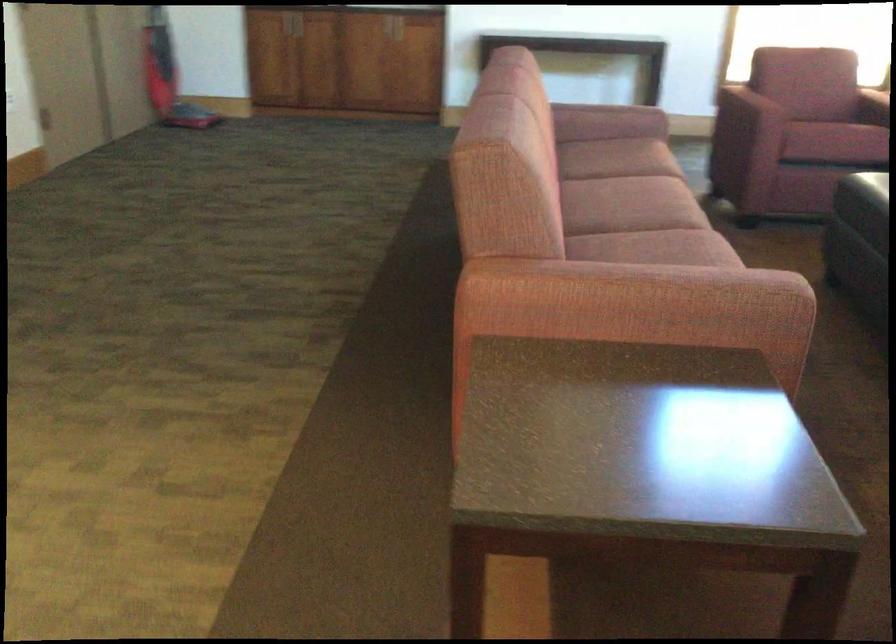
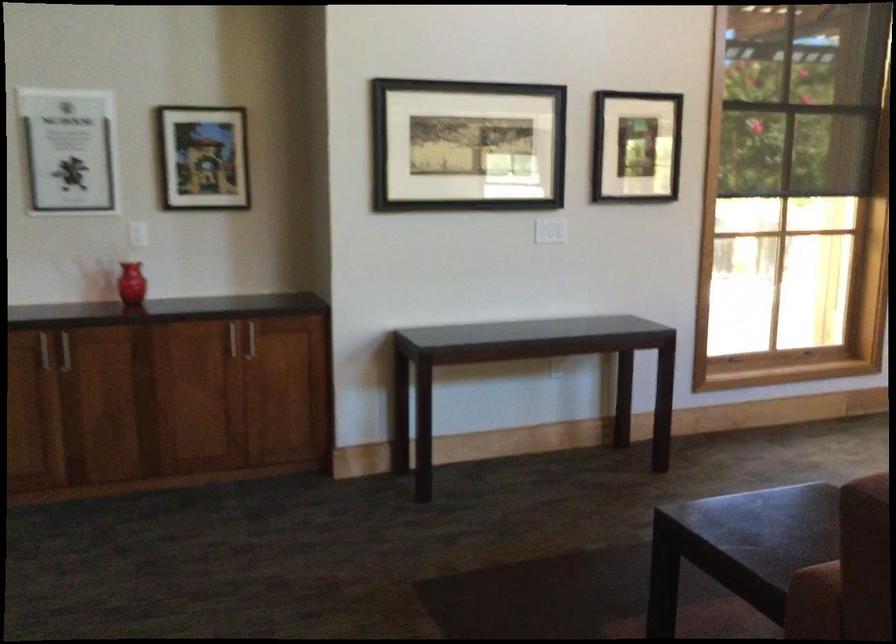
What movement of the cameraman would produce the second image?

The movement direction of the cameraman is left, forward.